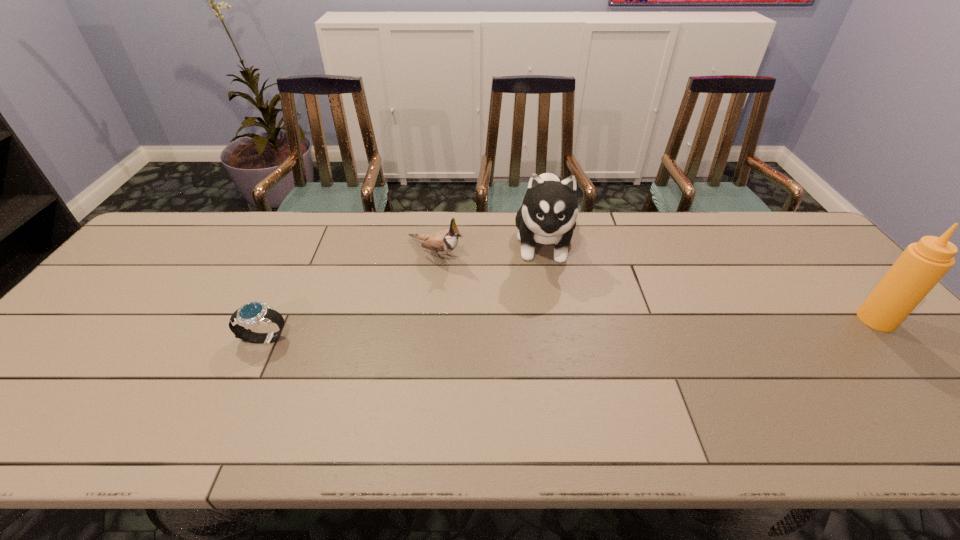
The height and width of the screenshot is (540, 960). Find the location of `vacant spot on the desktop that is between the watch and the condiment and is positioned at the face of the puppy`. vacant spot on the desktop that is between the watch and the condiment and is positioned at the face of the puppy is located at coordinates (544, 329).

Identify the location of free spot on the desktop that is between the leftmost object and the condiment and is positioned at the face of the bird. (561, 329).